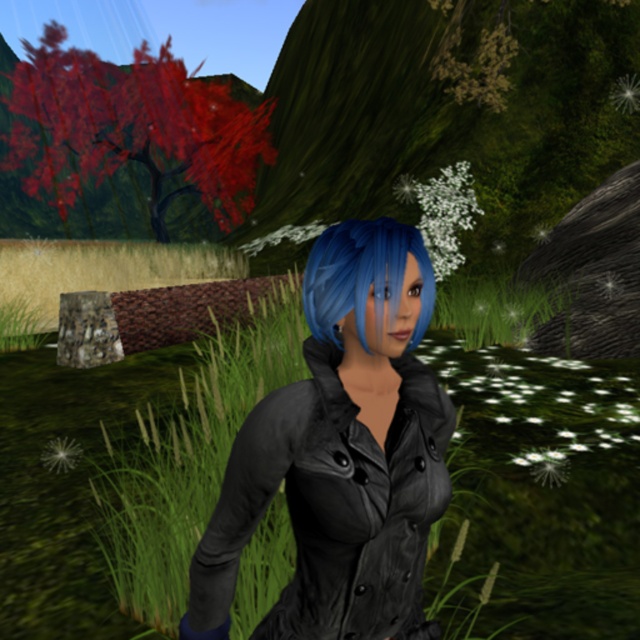
Is point (348, 282) positioned in front of point (384, 230)?

Yes, it is.

Describe the element at coordinates (340, 452) in the screenshot. I see `matte black jacket at center` at that location.

Image resolution: width=640 pixels, height=640 pixels. In order to click on matte black jacket at center in this screenshot , I will do `click(340, 452)`.

Between green matte grass at center and blue matte hair at center, which one appears on the left side from the viewer's perspective?

green matte grass at center is more to the left.

Is point (632, 360) positioned before point (355, 269)?

No, (632, 360) is further to viewer.

Describe the element at coordinates (545, 493) in the screenshot. I see `green matte grass at center` at that location.

At what (x,y) coordinates should I click in order to perform the action: click on green matte grass at center. Please return your answer as a coordinate pair (x, y). The width and height of the screenshot is (640, 640). Looking at the image, I should click on tap(545, 493).

Who is positioned more to the left, green matte grass at center or shiny red tree at upper left?

Positioned to the left is shiny red tree at upper left.

Can you confirm if green matte grass at center is positioned below shiny red tree at upper left?

Correct, green matte grass at center is located below shiny red tree at upper left.

Measure the distance between point (x=93, y=449) and camera.

A distance of 5.08 meters exists between point (x=93, y=449) and camera.

Identify the location of green matte grass at center. (545, 493).